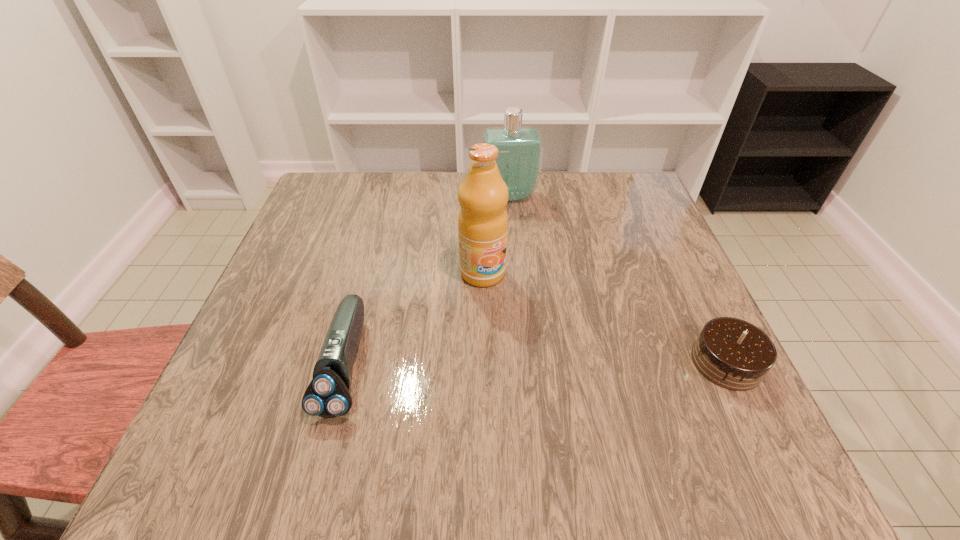
Locate an element on the screen. The image size is (960, 540). unoccupied position between the electric shaver and the rightmost object is located at coordinates (536, 363).

The height and width of the screenshot is (540, 960). Identify the location of blank region between the leftmost object and the chocolate cake. (536, 363).

At what (x,y) coordinates should I click in order to perform the action: click on the closest object to the chocolate cake. Please return your answer as a coordinate pair (x, y). The height and width of the screenshot is (540, 960). Looking at the image, I should click on (483, 195).

Identify which object is the second closest to the perfume. Please provide its 2D coordinates. Your answer should be formatted as a tuple, i.e. [(x, y)], where the tuple contains the x and y coordinates of a point satisfying the conditions above.

[(328, 395)]

The height and width of the screenshot is (540, 960). What are the coordinates of `free space that satisfies the following two spatial constraints: 1. on the back side of the tallest object; 2. on the right side of the perfume` in the screenshot? It's located at (482, 197).

Identify the location of free space that satisfies the following two spatial constraints: 1. on the front side of the rightmost object; 2. on the left side of the third shortest object. (523, 362).

Locate an element on the screen. This screenshot has width=960, height=540. vacant position in the image that satisfies the following two spatial constraints: 1. on the back side of the second farthest object; 2. on the left side of the perfume is located at coordinates (482, 197).